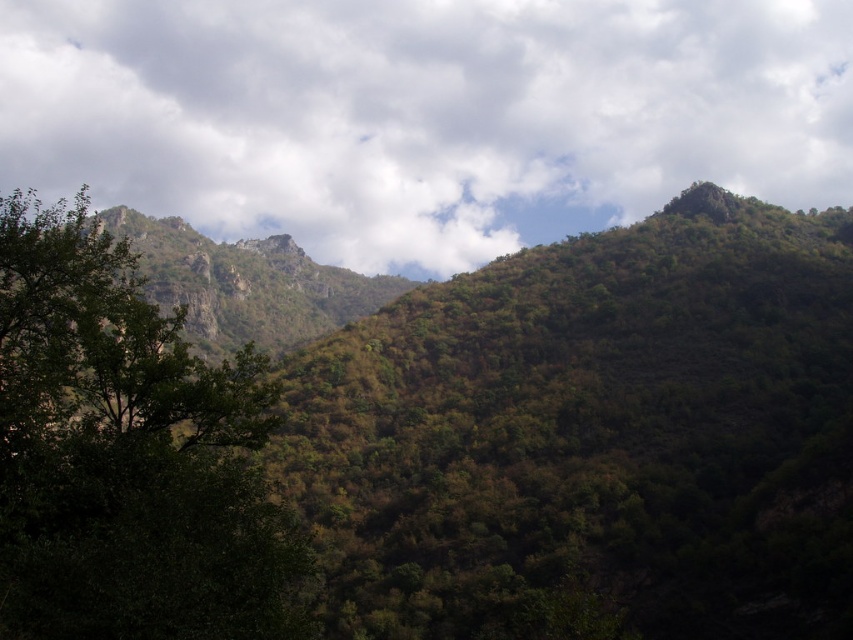
Looking at this image, you are a hiker standing at the base of the mountain looking upwards. You notice the green leafy forest at upper center and the white fluffy cloud at upper center. Which of these two objects is positioned higher in the sky?

The white fluffy cloud at upper center is positioned higher in the sky than the green leafy forest at upper center because the green leafy forest at upper center is located below it.

You are a hiker planning a trail between the green leafy forest at upper center and the green leafy tree at left. Given that your average walking pace is 1.4 meters per second, how long will it take you to walk directly between these two landmarks?

The distance between the green leafy forest at upper center and the green leafy tree at left is 83.47 meters. At a pace of 1.4 meters per second, it would take approximately 59.6 seconds, which is roughly 1 minute. So, it will take about 1 minute to walk directly between them.

You are standing at the point marked as point (735, 67) in the mountainous landscape. You want to hike to the base of the mountain on the left side. Given that the distance between you and the viewer is 706.21 meters, is this distance sufficient to reach the base of the mountain on the left side?

The distance between you and the viewer is 706.21 meters, but the question is about reaching the base of the mountain on the left side. The provided information does not specify the distance to the mountain base, so it cannot be determined if 706.21 meters is sufficient.